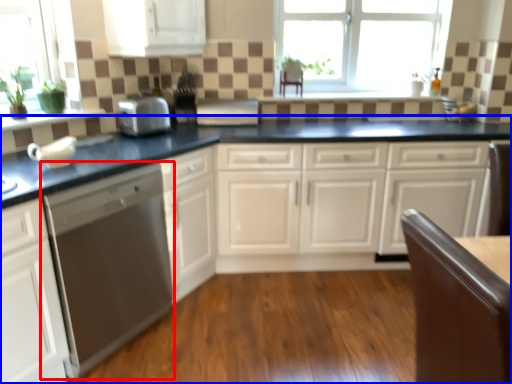
Question: Among these objects, which one is farthest to the camera, home appliance (highlighted by a red box) or countertop (highlighted by a blue box)?

Choices:
 (A) home appliance
 (B) countertop

Answer: (B)